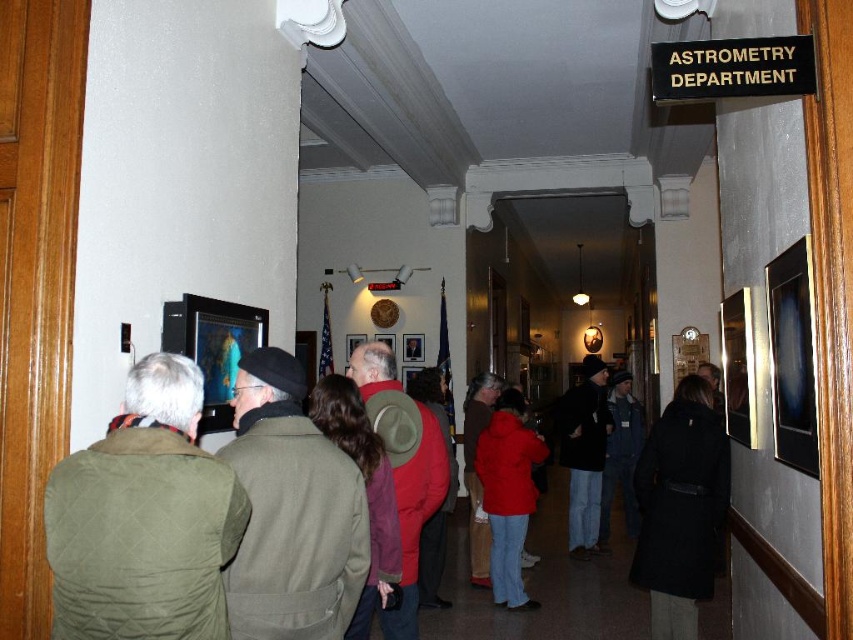
You are standing in the hallway and need to place a red wool coat at center. Where exactly should you place it?

The red wool coat at center should be placed at the coordinates point (289, 522) as specified.

You are a visitor in this hallway and want to greet someone wearing a green quilted jacket at left and a black wool coat at lower right. Which person should you approach first if you are standing in the center of the hallway?

You should approach the green quilted jacket at left first because it is to the left of the black wool coat at lower right, so it is closer to your position in the center of the hallway.

You are standing in the hallway and need to place a new sign between the red wool coat at center and the metallic reflective photo frame at right. Based on their positions, which object should the sign be closer to?

The sign should be placed closer to the metallic reflective photo frame at right because the red wool coat at center is to the left of it.